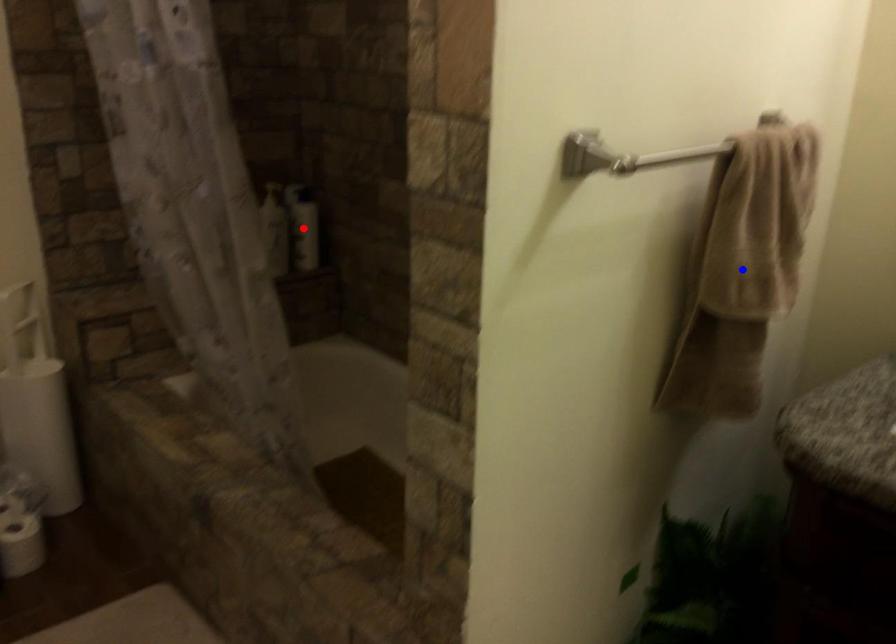
Question: Two points are marked on the image. Which point is closer to the camera?

Choices:
 (A) Blue point is closer.
 (B) Red point is closer.

Answer: (A)